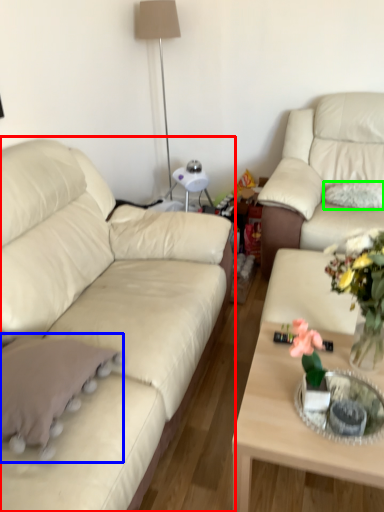
Question: Which object is positioned farthest from studio couch (highlighted by a red box)? Select from throw pillow (highlighted by a blue box) and pillow (highlighted by a green box).

Choices:
 (A) throw pillow
 (B) pillow

Answer: (B)